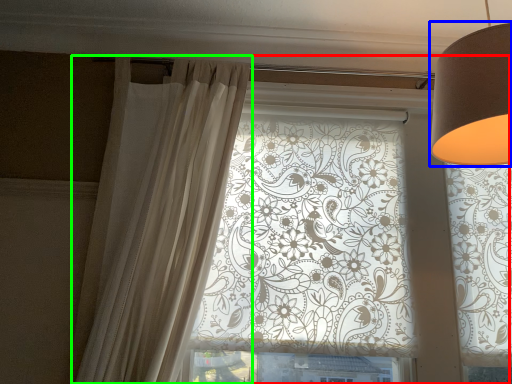
Question: Which is nearer to the window (highlighted by a red box)? lamp (highlighted by a blue box) or curtain (highlighted by a green box).

Choices:
 (A) lamp
 (B) curtain

Answer: (B)